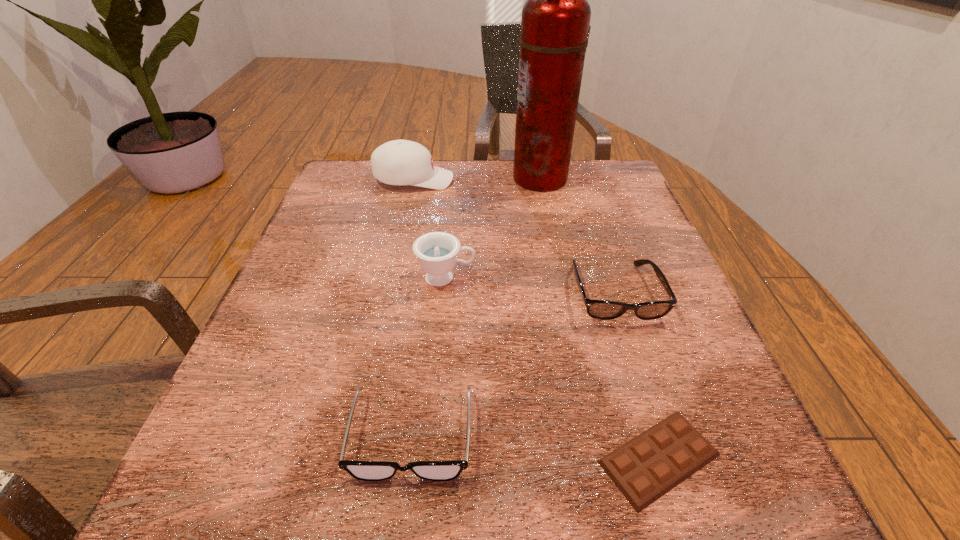
Find the location of a particular element. Image resolution: width=960 pixels, height=540 pixels. fire extinguisher is located at coordinates (555, 21).

Where is `the second tallest object`? the second tallest object is located at coordinates (399, 162).

Where is `the fourth shortest object`? Image resolution: width=960 pixels, height=540 pixels. the fourth shortest object is located at coordinates (437, 252).

Locate an element on the screen. The width and height of the screenshot is (960, 540). the right spectacles is located at coordinates (598, 309).

The width and height of the screenshot is (960, 540). I want to click on the taller spectacles, so click(598, 309).

Find the location of a particular element. the left spectacles is located at coordinates (361, 470).

Find the location of a particular element. The height and width of the screenshot is (540, 960). the nearer spectacles is located at coordinates (361, 470).

Identify the location of the shortest object. The height and width of the screenshot is (540, 960). (645, 468).

Identify the location of free space located 0.290m on the nozzle side of the fire extinguisher. This screenshot has width=960, height=540. coord(399,178).

At what (x,y) coordinates should I click in order to perform the action: click on free location located on the nozzle side of the fire extinguisher. Please return your answer as a coordinate pair (x, y). Looking at the image, I should click on (477, 178).